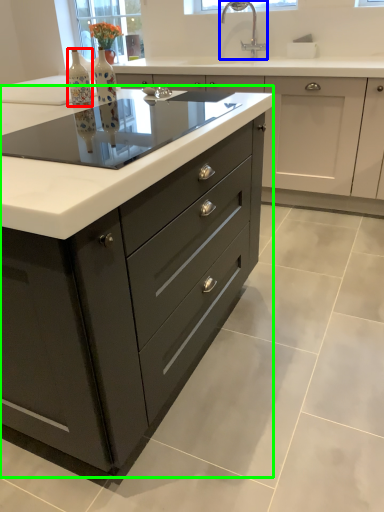
Question: Which is farther away from bottle (highlighted by a red box)? tap (highlighted by a blue box) or cabinetry (highlighted by a green box)?

Choices:
 (A) tap
 (B) cabinetry

Answer: (A)